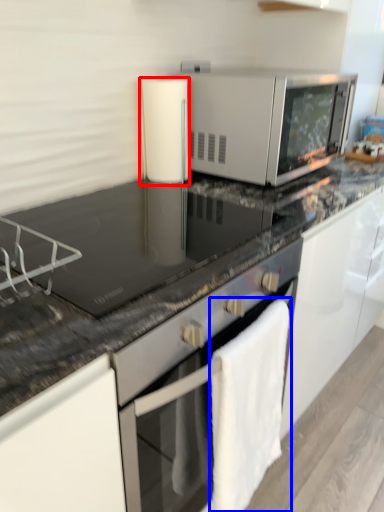
Question: Which object appears farthest to the camera in this image, appliance (highlighted by a red box) or bath towel (highlighted by a blue box)?

Choices:
 (A) appliance
 (B) bath towel

Answer: (A)